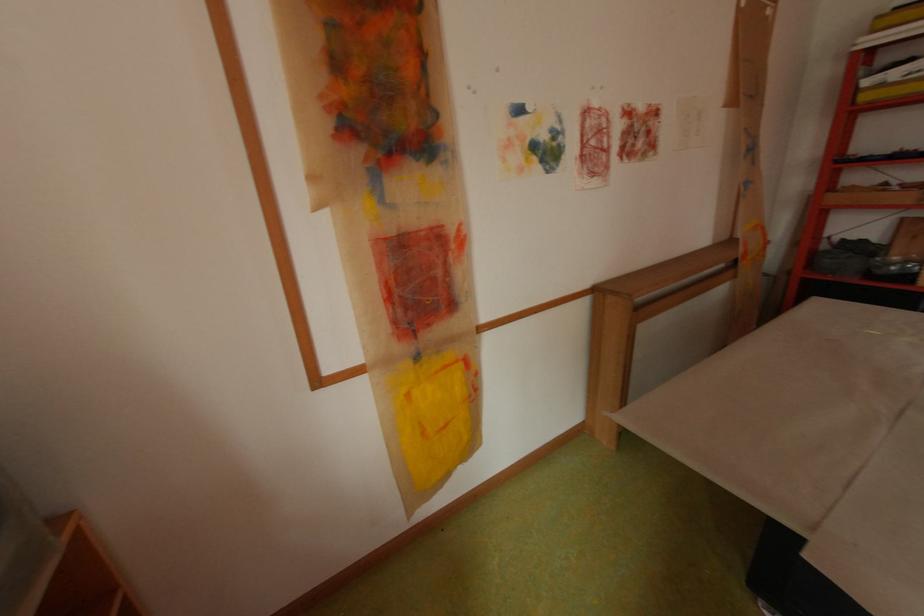
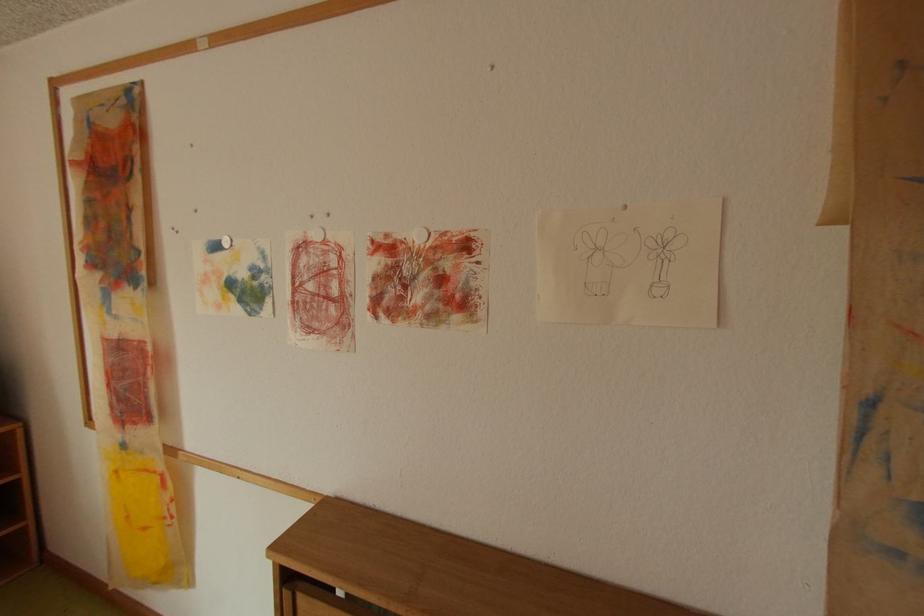
The point at (591, 148) is marked in the first image. Where is the corresponding point in the second image?

(304, 292)